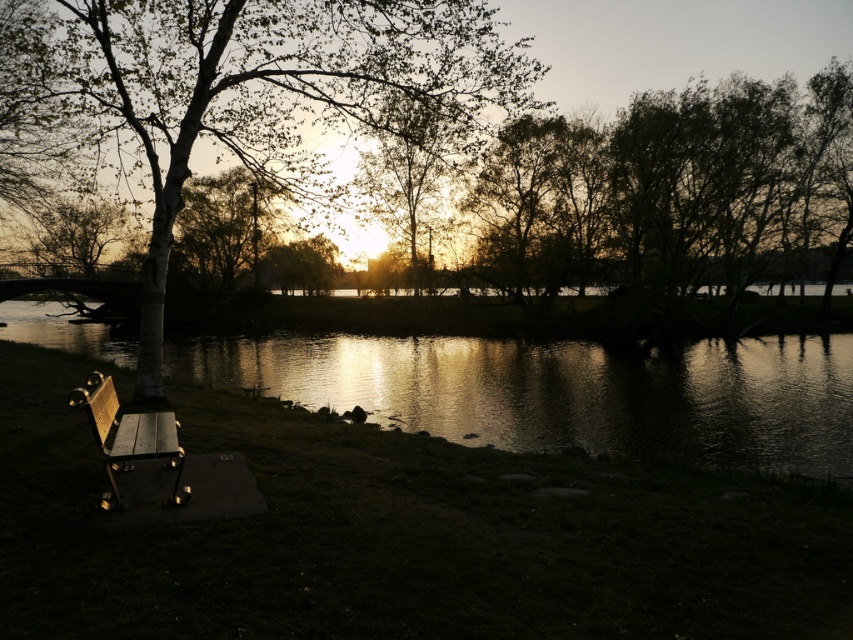
You are an artist setting up your easel to paint the lakeside scene. You want to ensure that the glistening water at center and the smooth white tree at center are both visible in your painting. Based on their sizes in the image, which object should you paint first to maintain proper perspective?

The glistening water at center is shorter than the smooth white tree at center, so you should paint the smooth white tree at center first as it is taller and needs to be positioned to maintain perspective.

You are an artist setting up your easel to paint the lakeside scene. You want to ensure your painting accurately represents the spatial relationship between the glistening water at center and the smooth bark tree at upper left. Based on the scene, which object appears taller in the composition?

The glistening water at center appears taller than the smooth bark tree at upper left in the composition.

You are a photographer wanting to capture the reflection of the smooth bark tree at upper left in the glistening water at center. Based on the scene, can you confirm if the tree is positioned above the water where its reflection would naturally appear?

Yes, the smooth bark tree at upper left is positioned above the glistening water at center, so its reflection should naturally appear in the water.